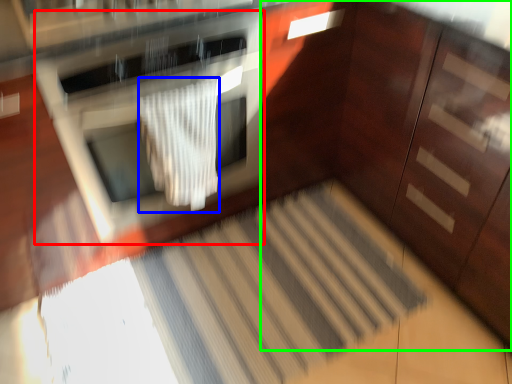
Question: Based on their relative distances, which object is nearer to oven (highlighted by a red box)? Choose from blanket (highlighted by a blue box) and dresser (highlighted by a green box).

Choices:
 (A) blanket
 (B) dresser

Answer: (A)